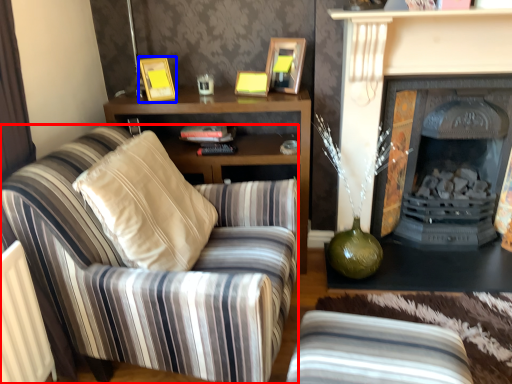
Question: Among these objects, which one is farthest to the camera, chair (highlighted by a red box) or picture frame (highlighted by a blue box)?

Choices:
 (A) chair
 (B) picture frame

Answer: (B)